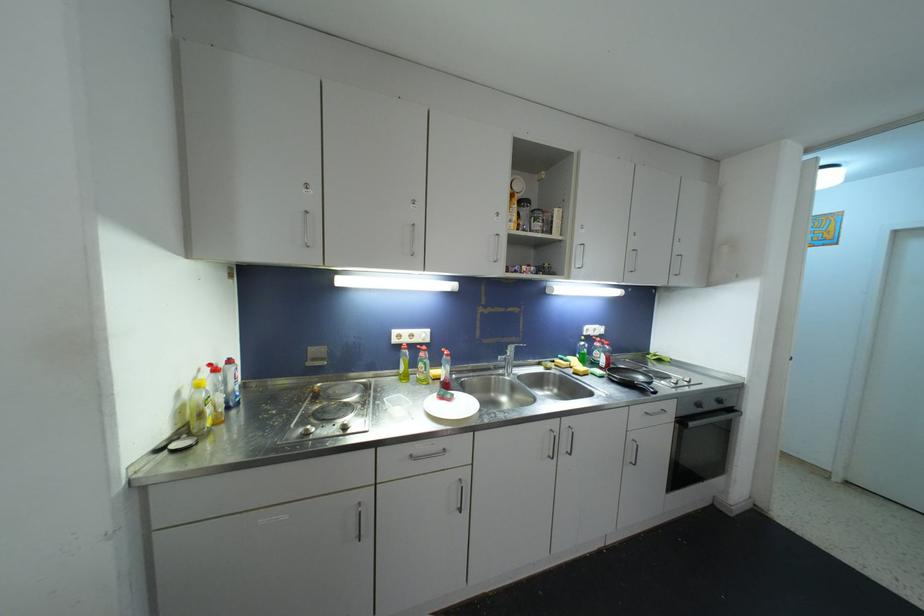
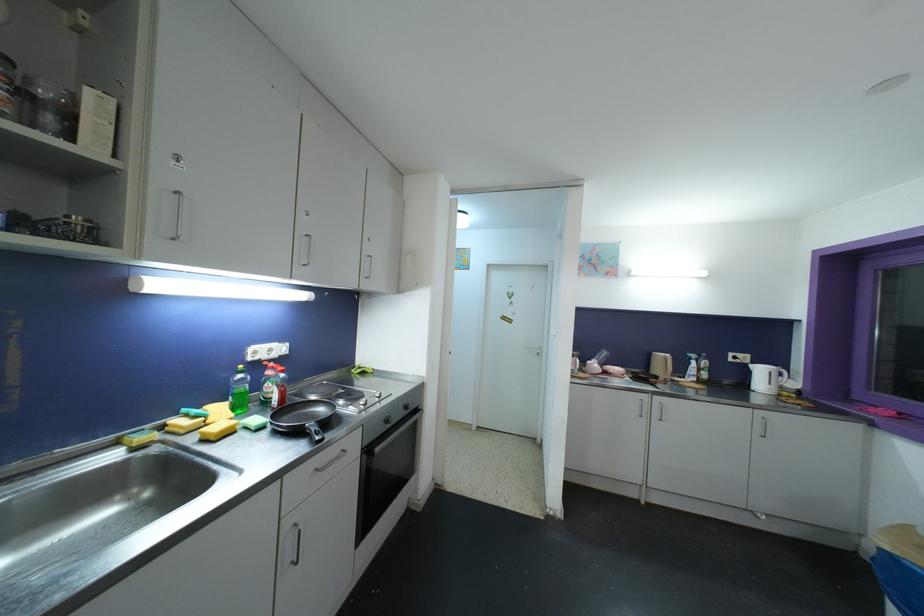
Where in the second image is the point corresponding to the point at 701,408 from the first image?

(390, 424)